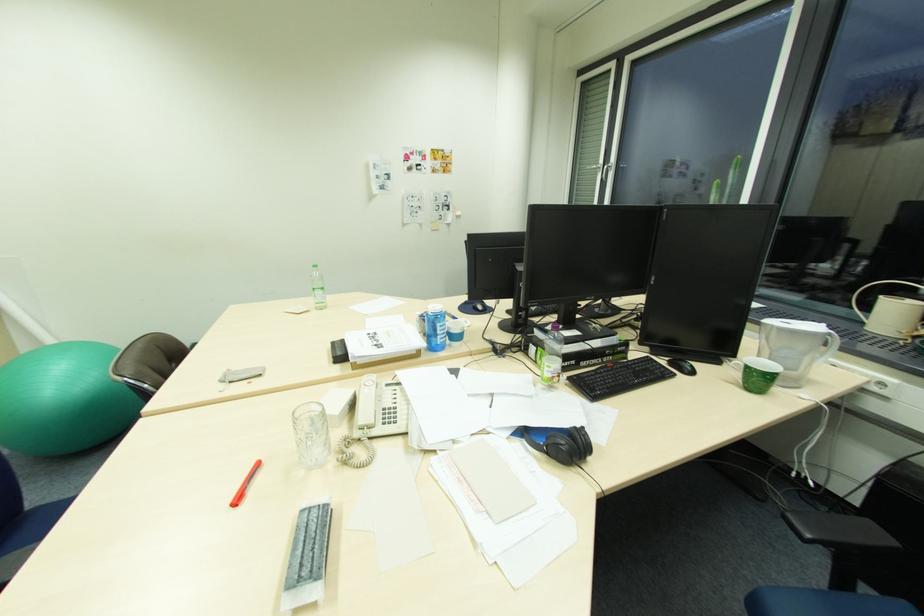
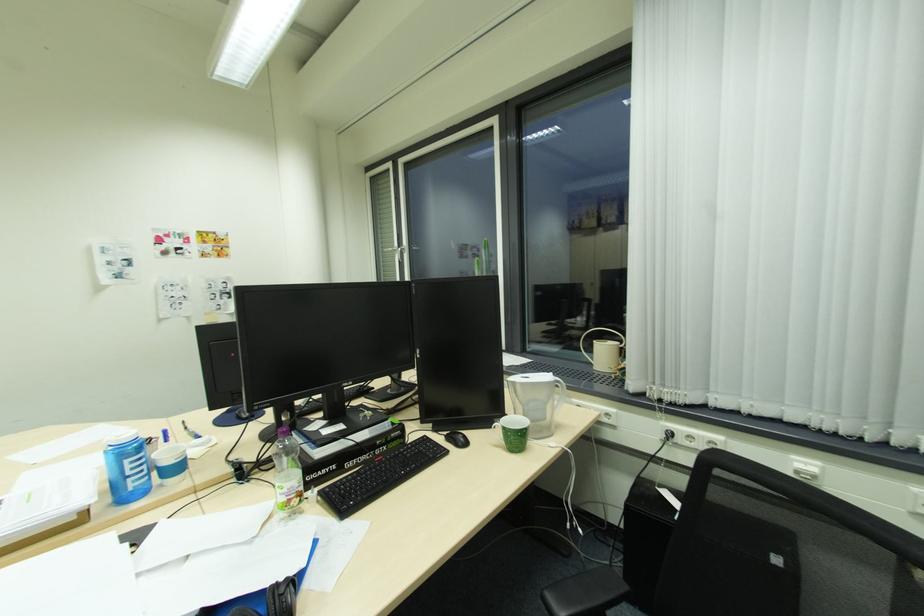
Question: Which direction would the cameraman need to move to produce the second image? Reply with the corresponding letter.

Choices:
 (A) Left
 (B) Right
 (C) Forward
 (D) Backward

Answer: (B)